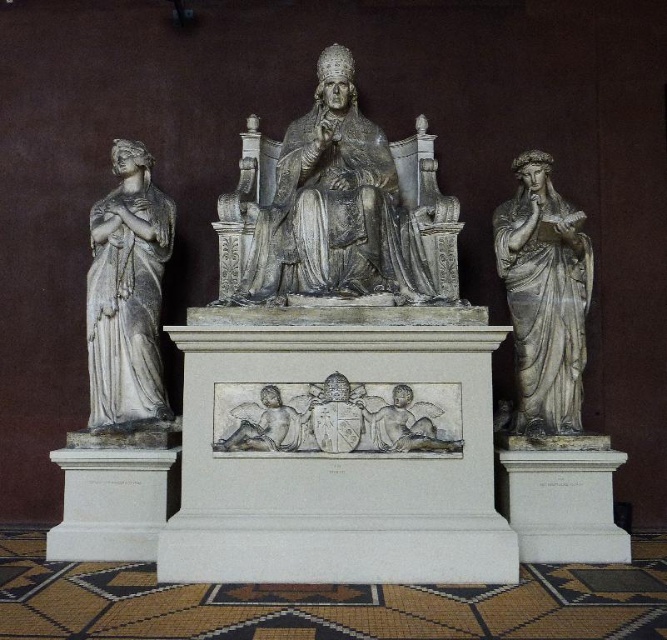
You are an art conservator examining the classical sculpture group. You need to locate the white marble statue at left. According to the coordinates provided, where would you find it?

The white marble statue at left is located at point (127, 294).

You are an art conservator examining the classical sculpture group. You notice a specific point at coordinates point (544, 296). What object is located at this point?

The point (544, 296) corresponds to the white marble statue at right.